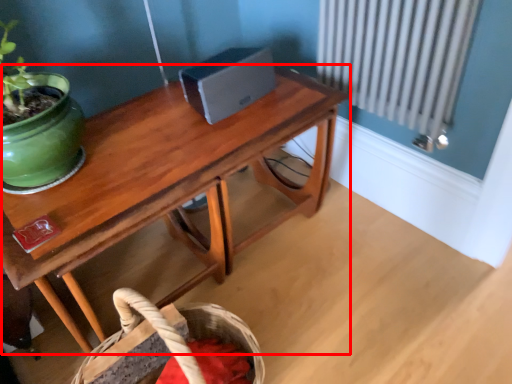
Question: From the image's perspective, considering the relative positions of table (annotated by the red box) and basket in the image provided, where is table (annotated by the red box) located with respect to the staircase?

Choices:
 (A) above
 (B) below

Answer: (A)